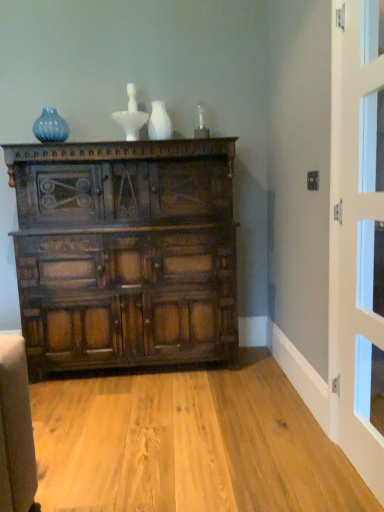
Question: Is dark brown wood chest of drawers at center taller or shorter than white glossy door at right?

Choices:
 (A) short
 (B) tall

Answer: (A)

Question: Considering the positions of point (16, 147) and point (360, 180), is point (16, 147) closer or farther from the camera than point (360, 180)?

Choices:
 (A) farther
 (B) closer

Answer: (A)

Question: Based on their relative distances, which object is nearer to the white glossy door at right?

Choices:
 (A) matte blue glass vase at upper left, placed as the 1th vase when sorted from left to right
 (B) dark brown wood chest of drawers at center
 (C) white glossy vase at upper center, positioned as the 2th vase in back-to-front order

Answer: (B)

Question: Estimate the real-world distances between objects in this image. Which object is closer to the white glossy vase at upper center, positioned as the 2th vase in back-to-front order?

Choices:
 (A) white glossy door at right
 (B) matte blue glass vase at upper left, marked as the first vase in a back-to-front arrangement
 (C) dark brown wood chest of drawers at center

Answer: (B)